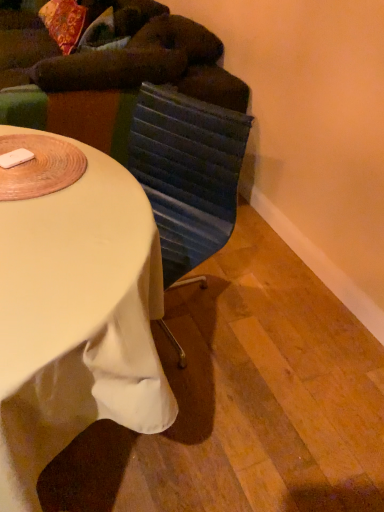
Question: Is textured blue swivel chair at center next to white fabric-covered desk at center?

Choices:
 (A) yes
 (B) no

Answer: (B)

Question: Can you confirm if textured blue swivel chair at center is bigger than white fabric-covered desk at center?

Choices:
 (A) no
 (B) yes

Answer: (A)

Question: Is textured blue swivel chair at center surrounding white fabric-covered desk at center?

Choices:
 (A) no
 (B) yes

Answer: (A)

Question: Is textured blue swivel chair at center outside of white fabric-covered desk at center?

Choices:
 (A) yes
 (B) no

Answer: (A)

Question: Is the depth of textured blue swivel chair at center greater than that of white fabric-covered desk at center?

Choices:
 (A) yes
 (B) no

Answer: (A)

Question: From a real-world perspective, is textured blue swivel chair at center on white fabric-covered desk at center?

Choices:
 (A) yes
 (B) no

Answer: (A)

Question: Is the depth of white fabric-covered desk at center less than that of textured blue swivel chair at center?

Choices:
 (A) no
 (B) yes

Answer: (B)

Question: Is white fabric-covered desk at center to the left of textured blue swivel chair at center from the viewer's perspective?

Choices:
 (A) yes
 (B) no

Answer: (A)

Question: Considering the relative sizes of white fabric-covered desk at center and textured blue swivel chair at center in the image provided, is white fabric-covered desk at center wider than textured blue swivel chair at center?

Choices:
 (A) yes
 (B) no

Answer: (A)

Question: Considering the relative sizes of white fabric-covered desk at center and textured blue swivel chair at center in the image provided, is white fabric-covered desk at center bigger than textured blue swivel chair at center?

Choices:
 (A) no
 (B) yes

Answer: (B)

Question: From the image's perspective, is white fabric-covered desk at center over textured blue swivel chair at center?

Choices:
 (A) yes
 (B) no

Answer: (B)

Question: Is white fabric-covered desk at center at the right side of textured blue swivel chair at center?

Choices:
 (A) no
 (B) yes

Answer: (A)

Question: Is dark green fabric bean bag chair at upper left bigger than white fabric-covered desk at center?

Choices:
 (A) no
 (B) yes

Answer: (B)